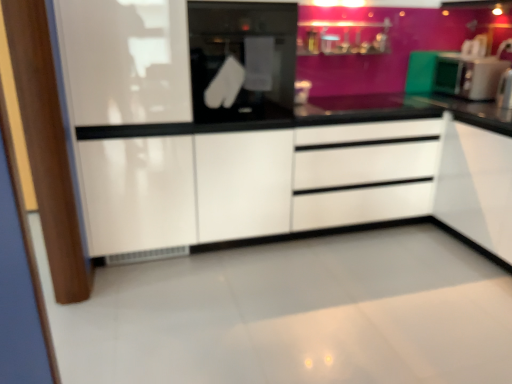
Question: Is the depth of white glossy drawer at center less than that of green matte microwave at right?

Choices:
 (A) no
 (B) yes

Answer: (B)

Question: Is white glossy drawer at center to the right of green matte microwave at right from the viewer's perspective?

Choices:
 (A) yes
 (B) no

Answer: (B)

Question: Is white glossy drawer at center oriented towards green matte microwave at right?

Choices:
 (A) no
 (B) yes

Answer: (A)

Question: Is white glossy drawer at center further to the viewer compared to green matte microwave at right?

Choices:
 (A) yes
 (B) no

Answer: (B)

Question: From the image's perspective, would you say white glossy drawer at center is shown under green matte microwave at right?

Choices:
 (A) no
 (B) yes

Answer: (B)

Question: Does white glossy drawer at center appear on the left side of green matte microwave at right?

Choices:
 (A) no
 (B) yes

Answer: (B)

Question: Does green matte microwave at right have a greater height compared to black glass oven at center?

Choices:
 (A) yes
 (B) no

Answer: (B)

Question: From a real-world perspective, is green matte microwave at right on black glass oven at center?

Choices:
 (A) yes
 (B) no

Answer: (B)

Question: Is green matte microwave at right at the left side of black glass oven at center?

Choices:
 (A) no
 (B) yes

Answer: (A)

Question: Is green matte microwave at right smaller than black glass oven at center?

Choices:
 (A) no
 (B) yes

Answer: (B)

Question: Does green matte microwave at right turn towards black glass oven at center?

Choices:
 (A) no
 (B) yes

Answer: (B)

Question: From the image's perspective, is green matte microwave at right on black glass oven at center?

Choices:
 (A) no
 (B) yes

Answer: (B)

Question: Would you say black glass oven at center is a long distance from white glossy cabinet at center?

Choices:
 (A) no
 (B) yes

Answer: (A)